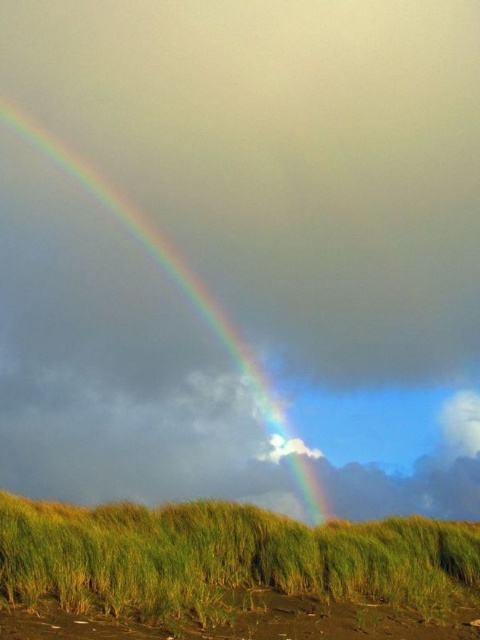
Who is positioned more to the right, brown sandy beach at lower center or rainbow at upper left?

From the viewer's perspective, brown sandy beach at lower center appears more on the right side.

Is brown sandy beach at lower center thinner than rainbow at upper left?

Yes.

This screenshot has height=640, width=480. Describe the element at coordinates (256, 620) in the screenshot. I see `brown sandy beach at lower center` at that location.

Where is `brown sandy beach at lower center`? brown sandy beach at lower center is located at coordinates (256, 620).

Does point (8, 557) lie in front of point (351, 637)?

Yes, it is.

Which is behind, point (226, 532) or point (348, 625)?

The point (226, 532) is more distant.

Which is behind, point (208, 504) or point (352, 600)?

The point (208, 504) is behind.

Locate an element on the screen. The image size is (480, 640). green grassy at lower center is located at coordinates (224, 560).

Identify the location of green grassy at lower center. The height and width of the screenshot is (640, 480). click(x=224, y=560).

Does point (108, 531) come in front of point (188, 275)?

Yes, it is in front of point (188, 275).

Where is `green grassy at lower center`? green grassy at lower center is located at coordinates (224, 560).